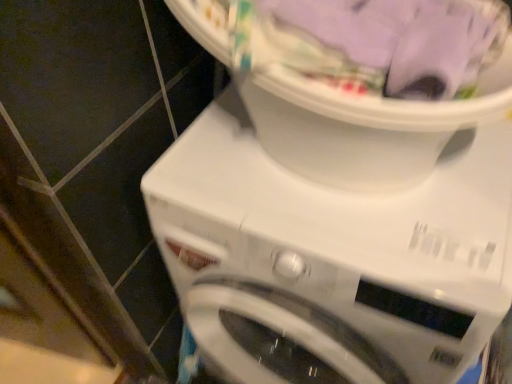
The height and width of the screenshot is (384, 512). In order to click on white plastic laundry basket at upper center in this screenshot , I will do `click(364, 127)`.

What do you see at coordinates (364, 127) in the screenshot? The width and height of the screenshot is (512, 384). I see `white plastic laundry basket at upper center` at bounding box center [364, 127].

Locate an element on the screen. white plastic washing machine at center is located at coordinates (339, 230).

Measure the distance between point [459,246] and camera.

A distance of 61.40 centimeters exists between point [459,246] and camera.

This screenshot has height=384, width=512. What do you see at coordinates (339, 230) in the screenshot? I see `white plastic washing machine at center` at bounding box center [339, 230].

Identify the location of white plastic laundry basket at upper center. The width and height of the screenshot is (512, 384). (364, 127).

Is white plastic washing machine at center at the left side of white plastic laundry basket at upper center?

Incorrect, white plastic washing machine at center is not on the left side of white plastic laundry basket at upper center.

Which is in front, white plastic washing machine at center or white plastic laundry basket at upper center?

white plastic laundry basket at upper center is in front.

Is point (301, 129) closer to viewer compared to point (362, 122)?

No, it is not.

From the image's perspective, is white plastic washing machine at center over white plastic laundry basket at upper center?

No, from the image's perspective, white plastic washing machine at center is not on top of white plastic laundry basket at upper center.

From a real-world perspective, who is located higher, white plastic washing machine at center or white plastic laundry basket at upper center?

white plastic laundry basket at upper center.

Is white plastic washing machine at center wider or thinner than white plastic laundry basket at upper center?

Considering their sizes, white plastic washing machine at center looks broader than white plastic laundry basket at upper center.

Which of these two, white plastic washing machine at center or white plastic laundry basket at upper center, stands taller?

Result: With more height is white plastic washing machine at center.

In terms of size, does white plastic washing machine at center appear bigger or smaller than white plastic laundry basket at upper center?

Considering their sizes, white plastic washing machine at center takes up more space than white plastic laundry basket at upper center.

Can white plastic laundry basket at upper center be found inside white plastic washing machine at center?

No, white plastic laundry basket at upper center is not inside white plastic washing machine at center.

Are white plastic washing machine at center and white plastic laundry basket at upper center beside each other?

There is a gap between white plastic washing machine at center and white plastic laundry basket at upper center.

Is white plastic washing machine at center aimed at white plastic laundry basket at upper center?

No, white plastic washing machine at center is not turned towards white plastic laundry basket at upper center.

How distant is white plastic washing machine at center from white plastic laundry basket at upper center?

A distance of 4.20 inches exists between white plastic washing machine at center and white plastic laundry basket at upper center.

In order to click on machine in front of the white plastic washing machine at center in this screenshot , I will do `click(364, 127)`.

Looking at this image, visually, is white plastic laundry basket at upper center positioned to the left or to the right of white plastic washing machine at center?

Clearly, white plastic laundry basket at upper center is on the left of white plastic washing machine at center in the image.

Considering their positions, is white plastic laundry basket at upper center located in front of or behind white plastic washing machine at center?

Clearly, white plastic laundry basket at upper center is in front of white plastic washing machine at center.

Does point (368, 137) lie in front of point (312, 205)?

Yes, it is in front of point (312, 205).

From the image's perspective, is white plastic laundry basket at upper center above or below white plastic washing machine at center?

Based on their image positions, white plastic laundry basket at upper center is located above white plastic washing machine at center.

From a real-world perspective, is white plastic laundry basket at upper center located higher than white plastic washing machine at center?

Indeed, from a real-world perspective, white plastic laundry basket at upper center stands above white plastic washing machine at center.

Is white plastic laundry basket at upper center wider or thinner than white plastic washing machine at center?

In the image, white plastic laundry basket at upper center appears to be more narrow than white plastic washing machine at center.

Considering the relative sizes of white plastic laundry basket at upper center and white plastic washing machine at center in the image provided, is white plastic laundry basket at upper center taller than white plastic washing machine at center?

In fact, white plastic laundry basket at upper center may be shorter than white plastic washing machine at center.

Can you confirm if white plastic laundry basket at upper center is bigger than white plastic washing machine at center?

Incorrect, white plastic laundry basket at upper center is not larger than white plastic washing machine at center.

Which is correct: white plastic laundry basket at upper center is inside white plastic washing machine at center, or outside of it?

white plastic laundry basket at upper center is located beyond the bounds of white plastic washing machine at center.

Is white plastic laundry basket at upper center not near white plastic washing machine at center?

Actually, white plastic laundry basket at upper center and white plastic washing machine at center are a little close together.

Could you tell me if white plastic laundry basket at upper center is facing white plastic washing machine at center?

No, white plastic laundry basket at upper center is not facing towards white plastic washing machine at center.

What's the angular difference between white plastic laundry basket at upper center and white plastic washing machine at center's facing directions?

0.000224 degrees.

Where is `machine above the white plastic washing machine at center (from a real-world perspective)`? machine above the white plastic washing machine at center (from a real-world perspective) is located at coordinates (364, 127).

At what (x,y) coordinates should I click in order to perform the action: click on washing machine on the right of white plastic laundry basket at upper center. Please return your answer as a coordinate pair (x, y). This screenshot has width=512, height=384. Looking at the image, I should click on (339, 230).

In order to click on machine located above the white plastic washing machine at center (from a real-world perspective) in this screenshot , I will do `click(364, 127)`.